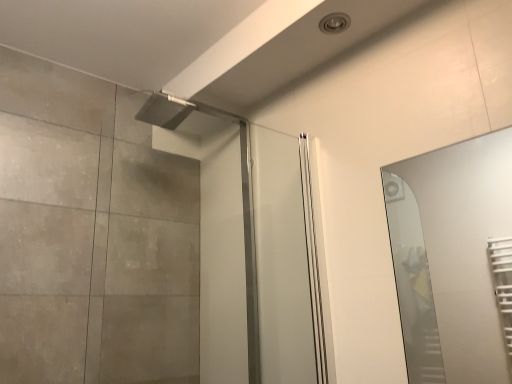
This screenshot has width=512, height=384. I want to click on clear glass screen door at upper center, so click(x=249, y=245).

Describe the element at coordinates (249, 245) in the screenshot. Image resolution: width=512 pixels, height=384 pixels. I see `clear glass screen door at upper center` at that location.

Measure the distance between point (478, 179) and camera.

7.72 feet.

Find the location of `clear glass mirror at right`. clear glass mirror at right is located at coordinates (454, 259).

What do you see at coordinates (454, 259) in the screenshot? The height and width of the screenshot is (384, 512). I see `clear glass mirror at right` at bounding box center [454, 259].

At what (x,y) coordinates should I click in order to perform the action: click on clear glass screen door at upper center. Please return your answer as a coordinate pair (x, y). The image size is (512, 384). Looking at the image, I should click on (249, 245).

Considering the relative positions of clear glass mirror at right and clear glass screen door at upper center in the image provided, is clear glass mirror at right to the left of clear glass screen door at upper center from the viewer's perspective?

Incorrect, clear glass mirror at right is not on the left side of clear glass screen door at upper center.

Is clear glass mirror at right positioned before clear glass screen door at upper center?

Yes.

Considering the points (438, 371) and (243, 167), which point is in front, point (438, 371) or point (243, 167)?

The point (243, 167) is in front.

From the image's perspective, is clear glass mirror at right positioned above or below clear glass screen door at upper center?

Based on their image positions, clear glass mirror at right is located beneath clear glass screen door at upper center.

From a real-world perspective, is clear glass mirror at right physically above clear glass screen door at upper center?

No.

Considering the relative sizes of clear glass mirror at right and clear glass screen door at upper center in the image provided, is clear glass mirror at right wider than clear glass screen door at upper center?

No, clear glass mirror at right is not wider than clear glass screen door at upper center.

Considering the sizes of objects clear glass mirror at right and clear glass screen door at upper center in the image provided, who is shorter, clear glass mirror at right or clear glass screen door at upper center?

With less height is clear glass mirror at right.

Looking at this image, who is smaller, clear glass mirror at right or clear glass screen door at upper center?

With smaller size is clear glass mirror at right.

Is clear glass mirror at right inside the boundaries of clear glass screen door at upper center, or outside?

clear glass mirror at right is located beyond the bounds of clear glass screen door at upper center.

Is clear glass mirror at right far away from clear glass screen door at upper center?

Yes.

Is clear glass mirror at right looking in the opposite direction of clear glass screen door at upper center?

That's not correct — clear glass mirror at right is not looking away from clear glass screen door at upper center.

Can you tell me how much clear glass mirror at right and clear glass screen door at upper center differ in facing direction?

The facing directions of clear glass mirror at right and clear glass screen door at upper center are 90 degrees apart.

Find the location of a particular element. The width and height of the screenshot is (512, 384). screen door on the left of the clear glass mirror at right is located at coordinates (249, 245).

Which object is positioned more to the right, clear glass screen door at upper center or clear glass mirror at right?

clear glass mirror at right.

Relative to clear glass mirror at right, is clear glass screen door at upper center in front or behind?

In the image, clear glass screen door at upper center appears behind clear glass mirror at right.

Does point (268, 274) come in front of point (466, 234)?

Yes, point (268, 274) is closer to viewer.

From the image's perspective, would you say clear glass screen door at upper center is positioned over clear glass mirror at right?

Indeed, from the image's perspective, clear glass screen door at upper center is shown above clear glass mirror at right.

From a real-world perspective, is clear glass screen door at upper center physically above clear glass mirror at right?

Correct, in the physical world, clear glass screen door at upper center is higher than clear glass mirror at right.

Considering the relative sizes of clear glass screen door at upper center and clear glass mirror at right in the image provided, is clear glass screen door at upper center wider than clear glass mirror at right?

Indeed, clear glass screen door at upper center has a greater width compared to clear glass mirror at right.

From their relative heights in the image, would you say clear glass screen door at upper center is taller or shorter than clear glass mirror at right?

clear glass screen door at upper center is taller than clear glass mirror at right.

In terms of size, does clear glass screen door at upper center appear bigger or smaller than clear glass mirror at right?

Considering their sizes, clear glass screen door at upper center takes up more space than clear glass mirror at right.

Is clear glass screen door at upper center outside of clear glass mirror at right?

Absolutely, clear glass screen door at upper center is external to clear glass mirror at right.

Is clear glass screen door at upper center far from clear glass mirror at right?

Yes, clear glass screen door at upper center and clear glass mirror at right are quite far apart.

Is clear glass screen door at upper center oriented towards clear glass mirror at right?

Yes, clear glass screen door at upper center faces towards clear glass mirror at right.

How distant is clear glass screen door at upper center from clear glass mirror at right?

clear glass screen door at upper center is 4.45 feet away from clear glass mirror at right.

The height and width of the screenshot is (384, 512). What are the coordinates of `screen door behind the clear glass mirror at right` in the screenshot? It's located at (249, 245).

I want to click on mirror in front of the clear glass screen door at upper center, so click(454, 259).

Image resolution: width=512 pixels, height=384 pixels. In order to click on screen door positioned vertically above the clear glass mirror at right (from a real-world perspective) in this screenshot , I will do `click(249, 245)`.